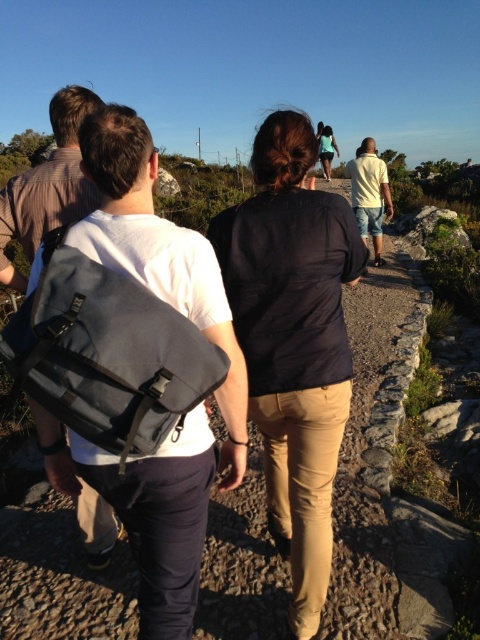
You are standing on the path and want to reach the point at coordinates point (142,275). There is an obstacle at point (250,262). Can you walk directly to your destination without going around the obstacle?

The point (250,262) is closer to you than point (142,275). Since the obstacle is in front of your destination, you cannot walk directly there and must go around.

You are a hiker trying to navigate the narrow rocky path in the image. You see two points marked on the path. The first point is at coordinates point (x=212, y=326) and the second is at point (x=130, y=397). Which of these points is closer to you as you stand on the path?

Point (x=212, y=326) is closer to you because it is further to the viewer than point (x=130, y=397).